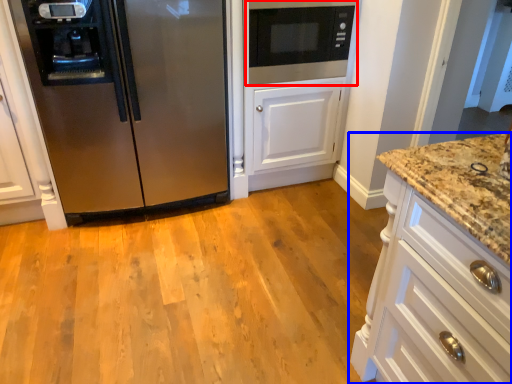
Question: Which object appears farthest to the camera in this image, microwave oven (highlighted by a red box) or cabinetry (highlighted by a blue box)?

Choices:
 (A) microwave oven
 (B) cabinetry

Answer: (A)